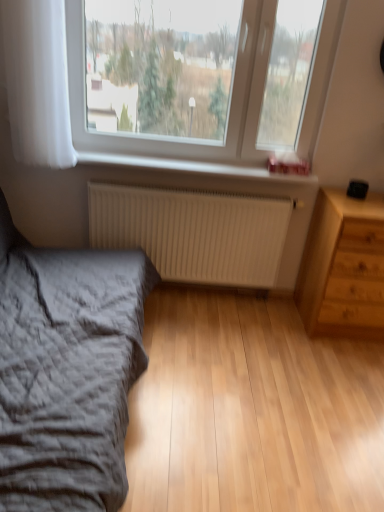
Question: From a real-world perspective, is gray textured bed at lower left below white sheer curtain at left?

Choices:
 (A) no
 (B) yes

Answer: (B)

Question: Is gray textured bed at lower left in front of white sheer curtain at left?

Choices:
 (A) yes
 (B) no

Answer: (A)

Question: Does gray textured bed at lower left have a lesser width compared to white sheer curtain at left?

Choices:
 (A) no
 (B) yes

Answer: (A)

Question: From the image's perspective, is gray textured bed at lower left under white sheer curtain at left?

Choices:
 (A) no
 (B) yes

Answer: (B)

Question: Would you say gray textured bed at lower left is outside white sheer curtain at left?

Choices:
 (A) yes
 (B) no

Answer: (A)

Question: Is gray textured bed at lower left not close to white sheer curtain at left?

Choices:
 (A) no
 (B) yes

Answer: (A)

Question: From a real-world perspective, is transparent glass window at upper center located beneath white matte radiator at lower center?

Choices:
 (A) no
 (B) yes

Answer: (A)

Question: Is transparent glass window at upper center positioned beyond the bounds of white matte radiator at lower center?

Choices:
 (A) yes
 (B) no

Answer: (A)

Question: Is transparent glass window at upper center oriented towards white matte radiator at lower center?

Choices:
 (A) yes
 (B) no

Answer: (B)

Question: Is the surface of transparent glass window at upper center in direct contact with white matte radiator at lower center?

Choices:
 (A) yes
 (B) no

Answer: (B)

Question: Is transparent glass window at upper center to the left of white matte radiator at lower center from the viewer's perspective?

Choices:
 (A) no
 (B) yes

Answer: (A)

Question: Is transparent glass window at upper center in front of white matte radiator at lower center?

Choices:
 (A) no
 (B) yes

Answer: (B)

Question: Does white matte radiator at lower center contain transparent glass window at upper center?

Choices:
 (A) yes
 (B) no

Answer: (B)